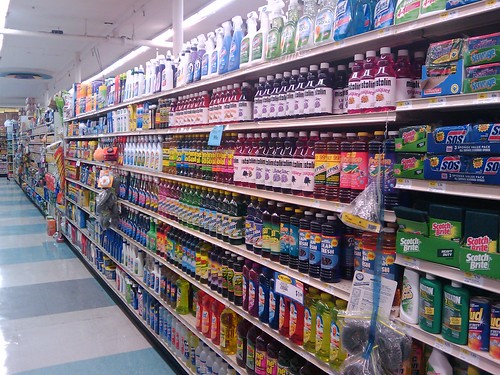
Image resolution: width=500 pixels, height=375 pixels. What are the coordinates of `blue floor tiles` in the screenshot? It's located at (159, 360), (81, 293), (38, 245), (25, 225), (19, 211), (12, 201), (6, 188).